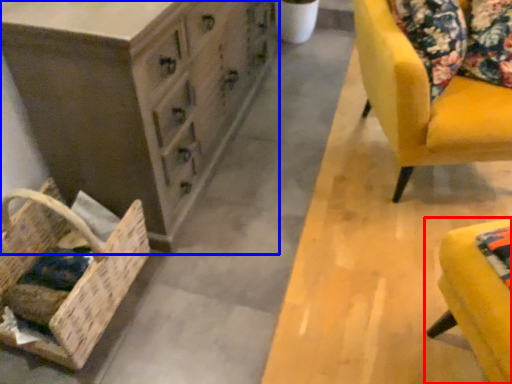
Question: Which object is closer to the camera taking this photo, furniture (highlighted by a red box) or chest of drawers (highlighted by a blue box)?

Choices:
 (A) furniture
 (B) chest of drawers

Answer: (A)